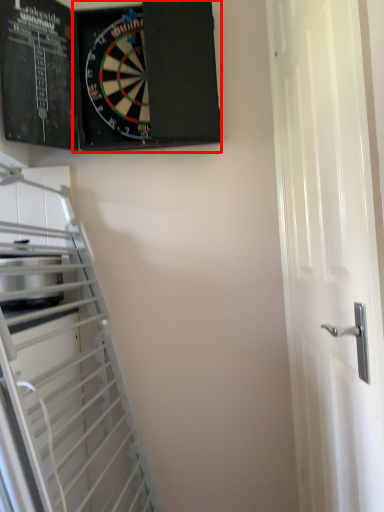
Question: From the image's perspective, what is the correct spatial relationship of bulletin board (annotated by the red box) in relation to door?

Choices:
 (A) below
 (B) above

Answer: (B)